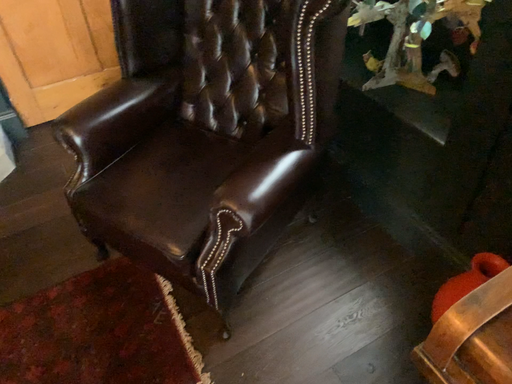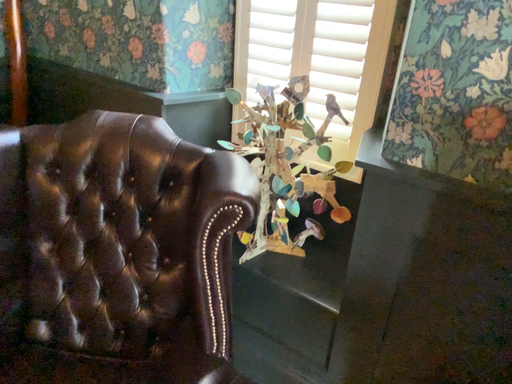
Question: Which way did the camera rotate in the video?

Choices:
 (A) rotated downward
 (B) rotated upward

Answer: (B)